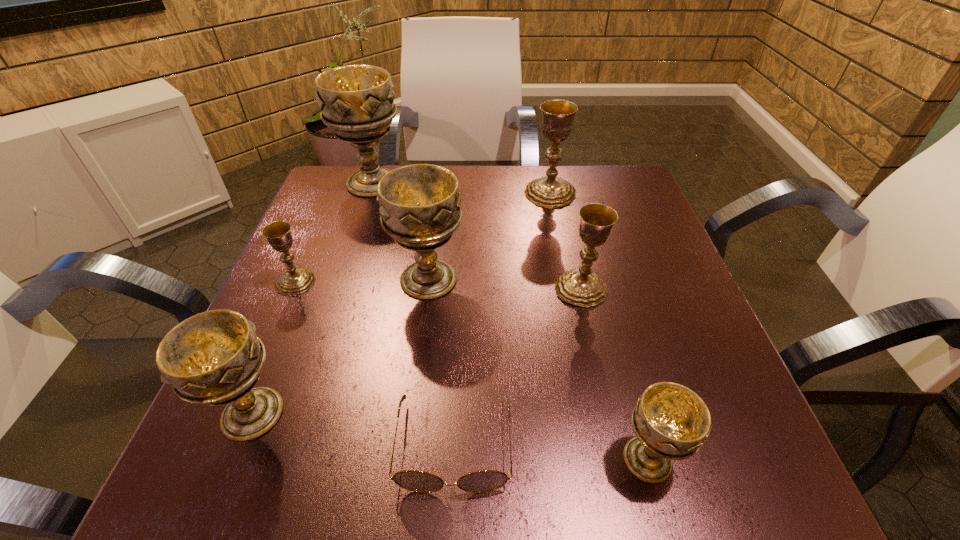
At what (x,y) coordinates should I click in order to perform the action: click on gray sunglasses. Please return your answer as a coordinate pair (x, y). Looking at the image, I should click on (482, 481).

At what (x,y) coordinates should I click in order to perform the action: click on vacant space located on the right of the tallest chalice. Please return your answer as a coordinate pair (x, y). This screenshot has height=540, width=960. Looking at the image, I should click on (442, 183).

The image size is (960, 540). In order to click on vacant area situated 0.360m on the front of the farthest gold chalice in this screenshot , I will do `click(577, 322)`.

Where is `free space located on the front of the second farthest white chalice`? free space located on the front of the second farthest white chalice is located at coordinates (403, 492).

The height and width of the screenshot is (540, 960). Identify the location of vacant space located 0.300m on the back of the second biggest gold chalice. (559, 190).

You are a GUI agent. You are given a task and a screenshot of the screen. Output one action in this format:
    pyautogui.click(x=<x>, y=<y>)
    Task: Click on the vacant space located on the right of the second smallest white chalice
    The width and height of the screenshot is (960, 540).
    Given the screenshot: What is the action you would take?
    pyautogui.click(x=400, y=414)

This screenshot has width=960, height=540. Find the location of `vacant space positioned on the front of the smallest gold chalice`. vacant space positioned on the front of the smallest gold chalice is located at coordinates (281, 315).

The width and height of the screenshot is (960, 540). Identify the location of blank space located 0.160m on the left of the rightmost white chalice. (505, 459).

Locate an element on the screen. Image resolution: width=960 pixels, height=540 pixels. sunglasses that is at the near edge is located at coordinates (482, 481).

Locate an element on the screen. object situated at the far left corner is located at coordinates (356, 102).